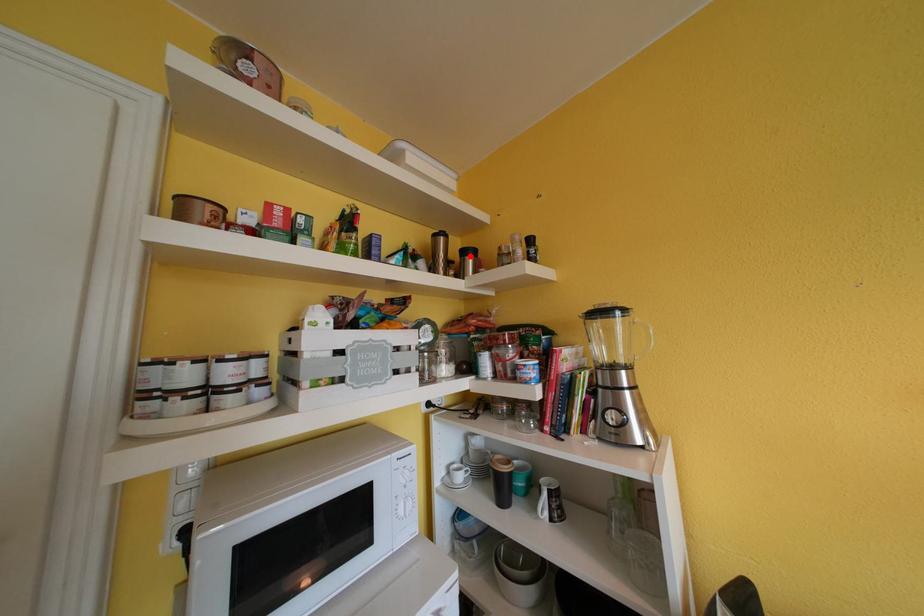
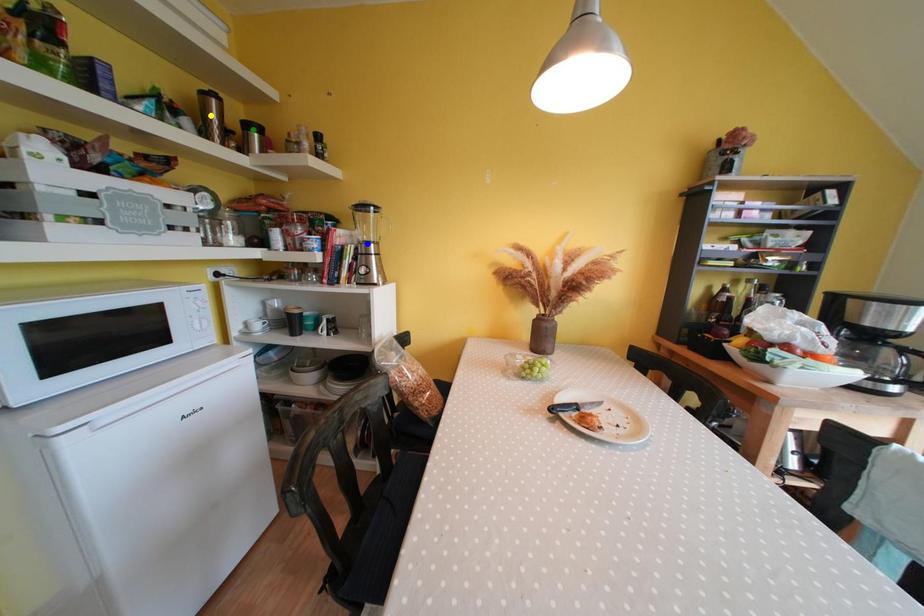
Question: I am providing you with two images of the same scene from different viewpoints. A red point is marked on the first image. You are given multiple points on the second image. Which spot in image 2 lines up with the point in image 1?

Choices:
 (A) blue point
 (B) yellow point
 (C) green point

Answer: (C)